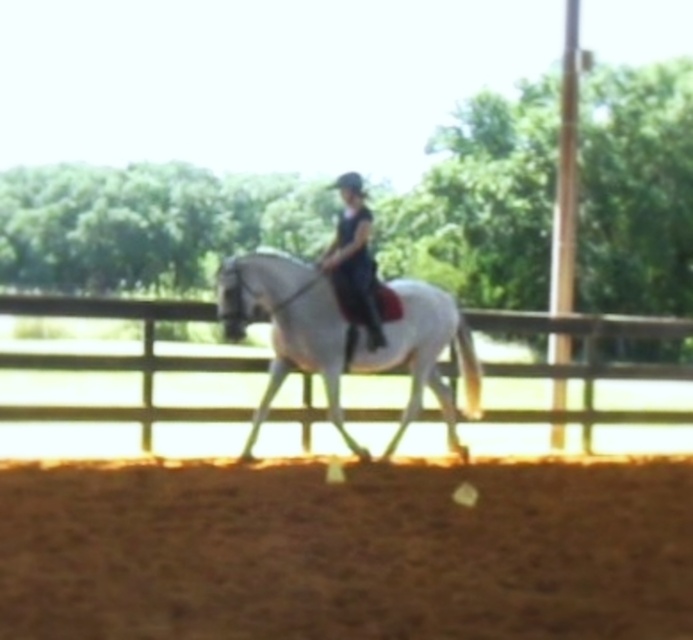
Can you confirm if brown sandy dirt track at lower center is positioned below white glossy horse at center?

Indeed, brown sandy dirt track at lower center is positioned under white glossy horse at center.

Between point (667, 552) and point (444, 401), which one is positioned in front?

Positioned in front is point (667, 552).

Who is more distant from viewer, (640, 486) or (439, 397)?

Point (439, 397)

Locate an element on the screen. This screenshot has width=693, height=640. brown sandy dirt track at lower center is located at coordinates (346, 548).

Is brown wooden fence at center thinner than white glossy horse at center?

In fact, brown wooden fence at center might be wider than white glossy horse at center.

This screenshot has width=693, height=640. What do you see at coordinates (121, 358) in the screenshot?
I see `brown wooden fence at center` at bounding box center [121, 358].

Who is more distant from viewer, (89, 365) or (396, 348)?

→ Positioned behind is point (89, 365).

Where is `brown wooden fence at center`? brown wooden fence at center is located at coordinates (121, 358).

Can you confirm if brown sandy dirt track at lower center is smaller than brown wooden fence at center?

Yes, brown sandy dirt track at lower center is smaller than brown wooden fence at center.

Find the location of a particular element. brown sandy dirt track at lower center is located at coordinates (346, 548).

At what (x,y) coordinates should I click in order to perform the action: click on brown sandy dirt track at lower center. Please return your answer as a coordinate pair (x, y). This screenshot has height=640, width=693. Looking at the image, I should click on (346, 548).